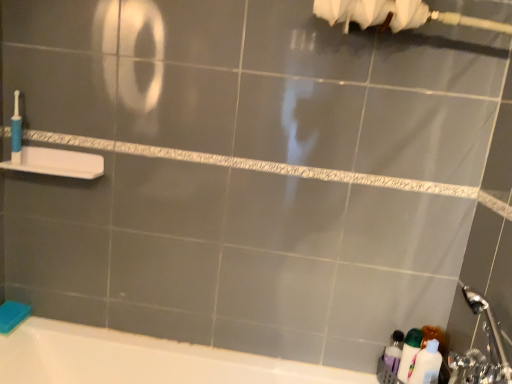
Question: Is white plastic shelf at left taller or shorter than blue plastic toothbrush at left?

Choices:
 (A) short
 (B) tall

Answer: (A)

Question: Relative to blue plastic toothbrush at left, is white plastic shelf at left in front or behind?

Choices:
 (A) front
 (B) behind

Answer: (A)

Question: Which of these objects is positioned farthest from the white glossy bottle at lower right?

Choices:
 (A) blue plastic toothbrush at left
 (B) translucent plastic bottles at lower right
 (C) white plastic shelf at left

Answer: (A)

Question: Which is farther from the white plastic shelf at left?

Choices:
 (A) blue plastic toothbrush at left
 (B) translucent plastic bottles at lower right
 (C) white glossy bottle at lower right

Answer: (B)